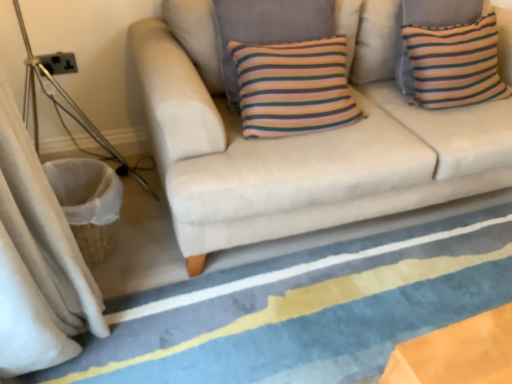
Question: Does beige fabric curtain at left have a greater height compared to striped fabric pillow at upper right?

Choices:
 (A) no
 (B) yes

Answer: (B)

Question: Can you confirm if beige fabric curtain at left is wider than striped fabric pillow at upper right?

Choices:
 (A) no
 (B) yes

Answer: (B)

Question: From a real-world perspective, is beige fabric curtain at left located higher than striped fabric pillow at upper right?

Choices:
 (A) no
 (B) yes

Answer: (A)

Question: Would you say beige fabric curtain at left contains striped fabric pillow at upper right?

Choices:
 (A) yes
 (B) no

Answer: (B)

Question: Does beige fabric curtain at left have a lesser height compared to striped fabric pillow at upper right?

Choices:
 (A) yes
 (B) no

Answer: (B)

Question: Could you tell me if beige fabric curtain at left is turned towards striped fabric pillow at upper right?

Choices:
 (A) yes
 (B) no

Answer: (A)

Question: Considering the relative sizes of blue striped rug at lower center and beige fabric couch at center in the image provided, is blue striped rug at lower center thinner than beige fabric couch at center?

Choices:
 (A) yes
 (B) no

Answer: (B)

Question: Is beige fabric couch at center inside blue striped rug at lower center?

Choices:
 (A) no
 (B) yes

Answer: (A)

Question: Is blue striped rug at lower center taller than beige fabric couch at center?

Choices:
 (A) yes
 (B) no

Answer: (B)

Question: Can you confirm if blue striped rug at lower center is smaller than beige fabric couch at center?

Choices:
 (A) no
 (B) yes

Answer: (B)

Question: From the image's perspective, would you say blue striped rug at lower center is shown under beige fabric couch at center?

Choices:
 (A) yes
 (B) no

Answer: (A)

Question: From a real-world perspective, does blue striped rug at lower center stand above beige fabric couch at center?

Choices:
 (A) yes
 (B) no

Answer: (B)

Question: Can you confirm if beige fabric couch at center is smaller than beige fabric curtain at left?

Choices:
 (A) yes
 (B) no

Answer: (B)